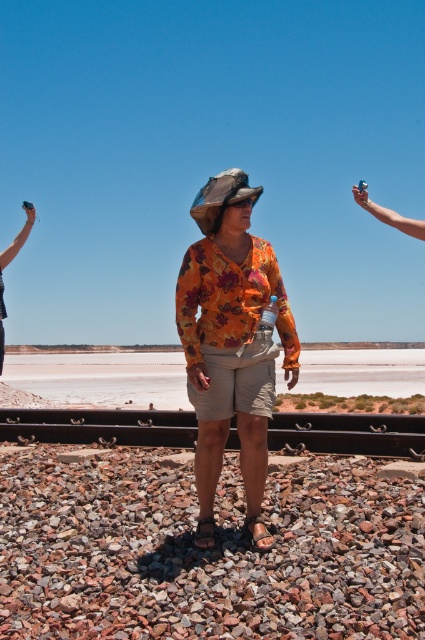
Does point (121, 506) lie behind point (357, 451)?

No, (121, 506) is closer to viewer.

Measure the distance between gray gravel at center and black metal train track at center.

The distance of gray gravel at center from black metal train track at center is 9.63 feet.

Is point (223, 600) more distant than point (371, 442)?

No, (223, 600) is closer to viewer.

Identify the location of gray gravel at center. The image size is (425, 640). (206, 552).

Looking at this image, between floral fabric shirt at center and black metal train track at center, which one appears on the right side from the viewer's perspective?

black metal train track at center

Is floral fabric shirt at center above black metal train track at center?

Correct, floral fabric shirt at center is located above black metal train track at center.

Who is more distant from viewer, (263, 481) or (368, 433)?

The point (368, 433) is behind.

Locate an element on the screen. The height and width of the screenshot is (640, 425). floral fabric shirt at center is located at coordinates (231, 342).

Is point (33, 476) positioned before point (3, 253)?

Yes.

Is point (382, 561) less distant than point (6, 250)?

That is True.

Where is `gray gravel at center`? gray gravel at center is located at coordinates (206, 552).